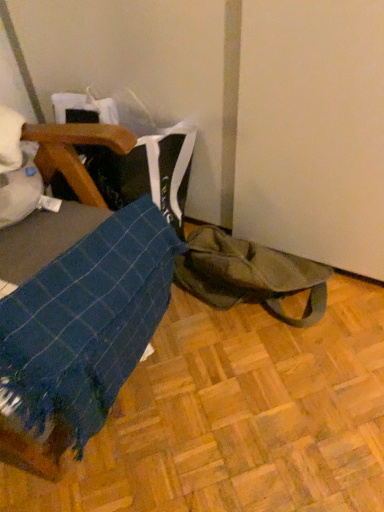
Question: From a real-world perspective, is olive green canvas tote bag at lower right positioned above or below blue woven fabric at lower left?

Choices:
 (A) above
 (B) below

Answer: (B)

Question: In the image, is olive green canvas tote bag at lower right positioned in front of or behind blue woven fabric at lower left?

Choices:
 (A) front
 (B) behind

Answer: (B)

Question: Would you say olive green canvas tote bag at lower right is inside or outside blue woven fabric at lower left?

Choices:
 (A) outside
 (B) inside

Answer: (A)

Question: From a real-world perspective, is blue woven fabric at lower left above or below olive green canvas tote bag at lower right?

Choices:
 (A) below
 (B) above

Answer: (B)

Question: Based on their positions, is blue woven fabric at lower left located to the left or right of olive green canvas tote bag at lower right?

Choices:
 (A) right
 (B) left

Answer: (B)

Question: Is blue woven fabric at lower left inside or outside of olive green canvas tote bag at lower right?

Choices:
 (A) outside
 (B) inside

Answer: (A)

Question: Is blue woven fabric at lower left in front of or behind olive green canvas tote bag at lower right in the image?

Choices:
 (A) behind
 (B) front

Answer: (B)